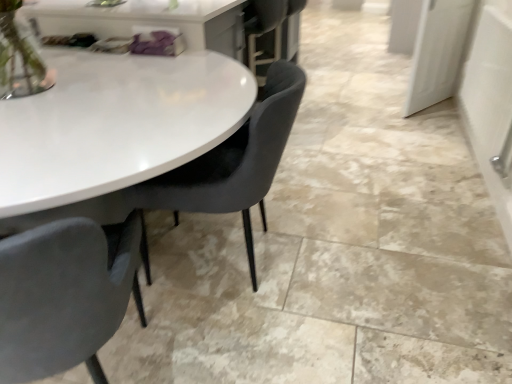
This screenshot has height=384, width=512. Find the location of `vacant area to the right of matte black chair at center, placed as the first chair when sorted from right to left`. vacant area to the right of matte black chair at center, placed as the first chair when sorted from right to left is located at coordinates (351, 260).